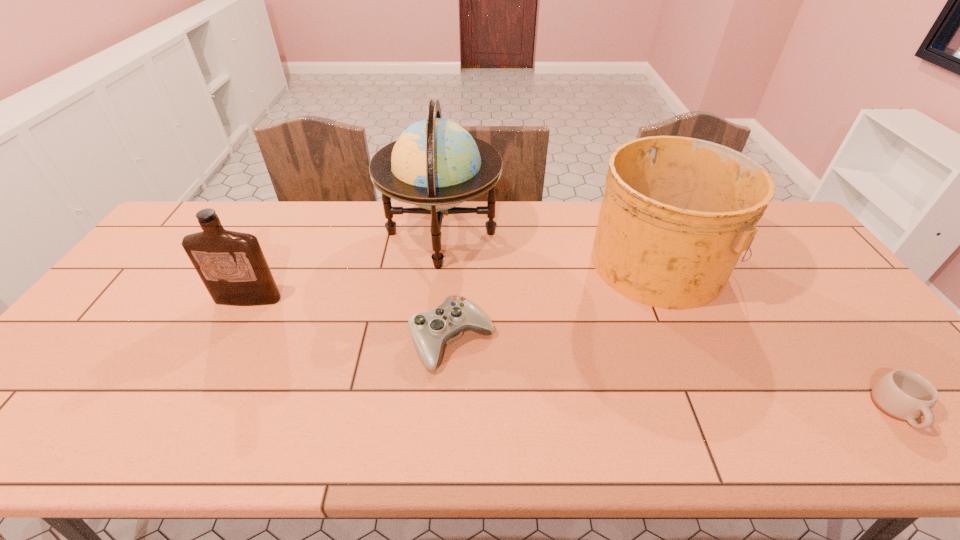
Identify the location of free space that satisfies the following two spatial constraints: 1. on the surface of the control; 2. on the right side of the tallest object. (430, 340).